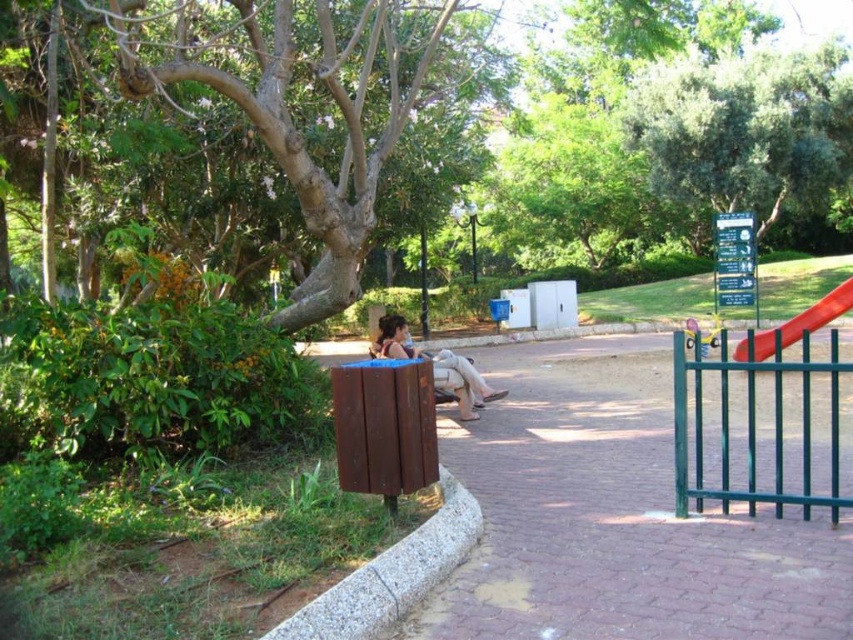
Question: Which object appears closest to the camera in this image?

Choices:
 (A) matte brown bench at center
 (B) green leafy tree at upper center
 (C) rubber smooth slide at right

Answer: (A)

Question: Estimate the real-world distances between objects in this image. Which object is closer to the rubber smooth slide at right?

Choices:
 (A) green leafy tree at upper center
 (B) matte brown bench at center
 (C) brown textured tree at center

Answer: (B)

Question: Is green leafy tree at upper center positioned at the back of rubber smooth slide at right?

Choices:
 (A) no
 (B) yes

Answer: (B)

Question: Estimate the real-world distances between objects in this image. Which object is closer to the matte brown bench at center?

Choices:
 (A) green leafy tree at upper center
 (B) brown textured tree at center
 (C) rubber smooth slide at right

Answer: (C)

Question: Can you confirm if green leafy tree at upper center is positioned to the right of rubber smooth slide at right?

Choices:
 (A) yes
 (B) no

Answer: (A)

Question: In this image, where is green leafy tree at upper center located relative to rubber smooth slide at right?

Choices:
 (A) left
 (B) right

Answer: (B)